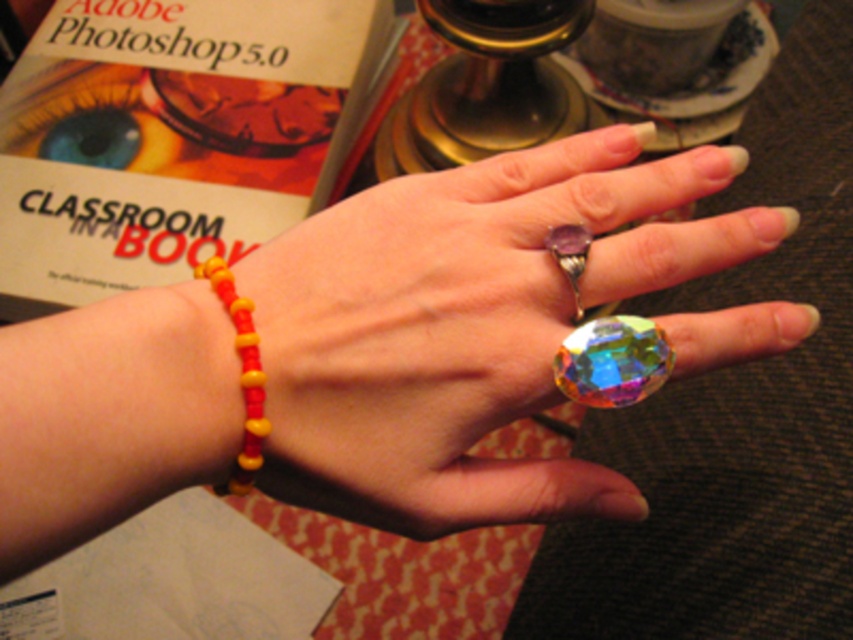
Is point (376, 492) positioned in front of point (242, 320)?

No, (376, 492) is behind (242, 320).

Does multicolored glass ring at center lie behind yellow matte beads at lower left?

Yes, it is behind yellow matte beads at lower left.

Which is behind, point (654, 173) or point (238, 468)?

Positioned behind is point (654, 173).

This screenshot has height=640, width=853. In order to click on multicolored glass ring at center in this screenshot , I will do `click(445, 333)`.

Who is shorter, yellow matte beads at lower left or purple gemstone ring at center?

purple gemstone ring at center is shorter.

Measure the distance between yellow matte beads at lower left and purple gemstone ring at center.

A distance of 4.00 inches exists between yellow matte beads at lower left and purple gemstone ring at center.

You are a GUI agent. You are given a task and a screenshot of the screen. Output one action in this format:
    pyautogui.click(x=<x>, y=<y>)
    Task: Click on the yellow matte beads at lower left
    
    Given the screenshot: What is the action you would take?
    pyautogui.click(x=241, y=372)

Who is positioned more to the right, multicolored glass ring at center or rainbow faceted glass bead at center?

rainbow faceted glass bead at center

Between multicolored glass ring at center and rainbow faceted glass bead at center, which one has more height?

Standing taller between the two is multicolored glass ring at center.

Is point (515, 202) positioned in front of point (602, 368)?

No, it is behind (602, 368).

Where is `multicolored glass ring at center`? This screenshot has height=640, width=853. multicolored glass ring at center is located at coordinates (445, 333).